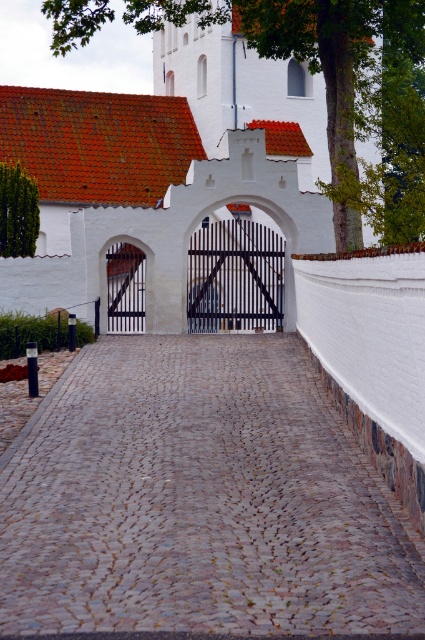
Question: Is green leafy tree at upper center closer to the viewer compared to white wooden gate at center?

Choices:
 (A) no
 (B) yes

Answer: (B)

Question: In this image, where is black metal gate at center located relative to white wooden gate at center?

Choices:
 (A) above
 (B) below

Answer: (A)

Question: Can you confirm if green leafy tree at left is wider than white wooden gate at center?

Choices:
 (A) no
 (B) yes

Answer: (A)

Question: Estimate the real-world distances between objects in this image. Which object is farther from the green leafy tree at left?

Choices:
 (A) white wooden gate at center
 (B) black metal gate at center

Answer: (B)

Question: Which object is farther from the camera taking this photo?

Choices:
 (A) black metal gate at center
 (B) green leafy tree at upper center
 (C) white wooden gate at center

Answer: (C)

Question: Which object is positioned closest to the white wooden gate at center?

Choices:
 (A) black metal gate at center
 (B) green leafy tree at upper center

Answer: (A)